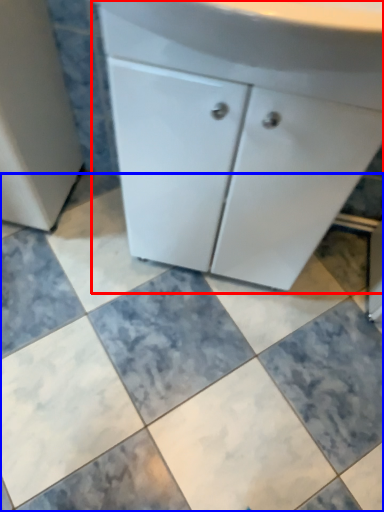
Question: Which object is further to the camera taking this photo, bathroom cabinet (highlighted by a red box) or ceramic tile (highlighted by a blue box)?

Choices:
 (A) bathroom cabinet
 (B) ceramic tile

Answer: (B)